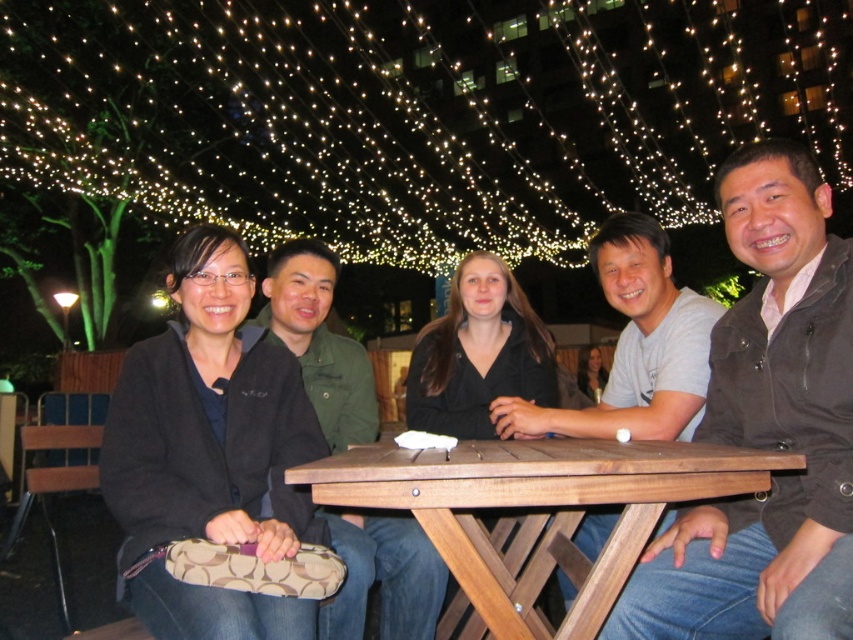
You are standing behind the picnic table and want to hand a napkin to the person wearing the brown leather jacket at right without disturbing the person in the black fuzzy sweater at left. How should you approach?

Since the brown leather jacket at right is in front of the black fuzzy sweater at left, you can approach from behind the brown leather jacket at right to hand the napkin without disturbing the person in the black fuzzy sweater at left.

You are standing in front of the picnic table and want to place a small decoration between the two points, point (x=178, y=358) and point (x=635, y=472). Which point is closer to you so you can start placing the decoration from there?

Point (x=178, y=358) is closer to you than point (x=635, y=472), so you should start placing the decoration from point (x=178, y=358).